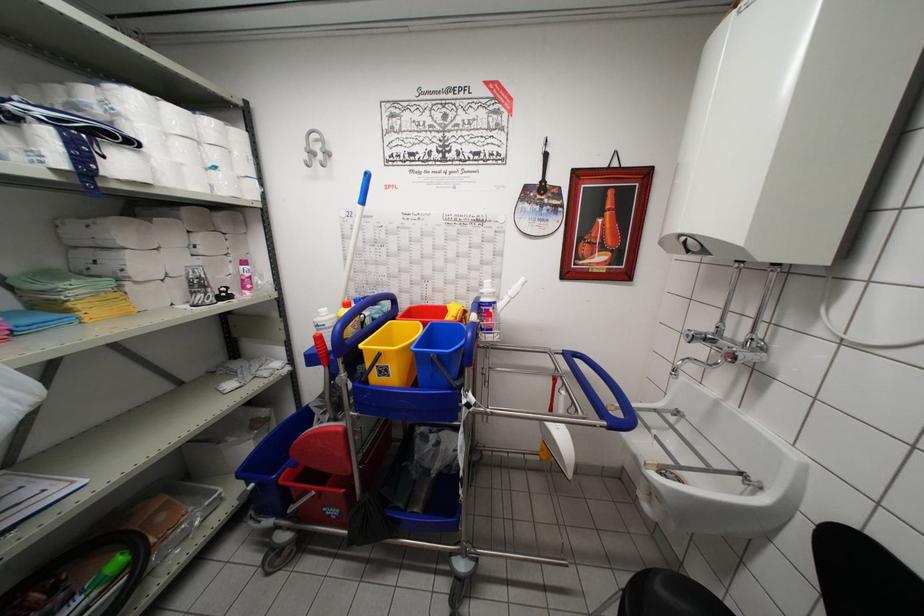
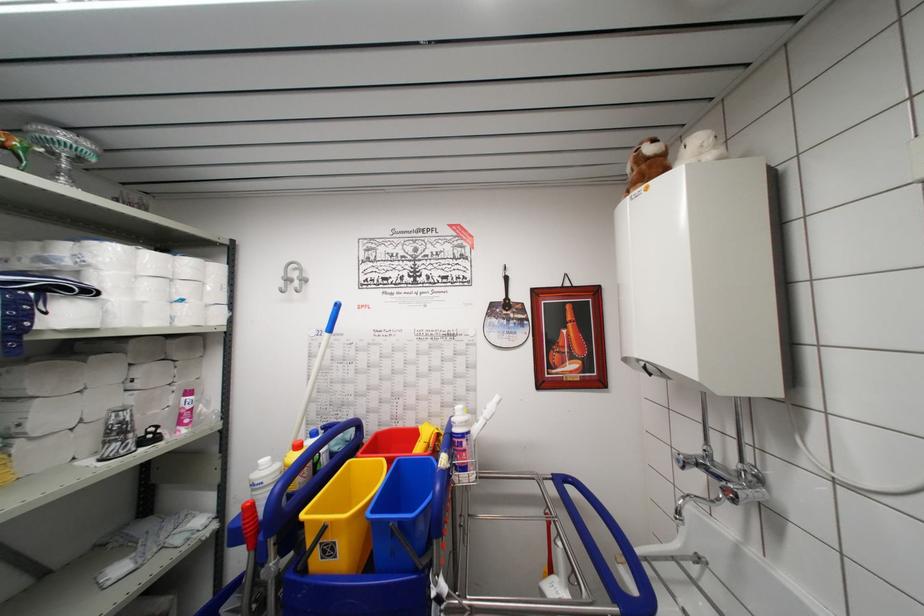
Find the pixel in the second image that matches the highlighted location in the first image.

(460, 447)